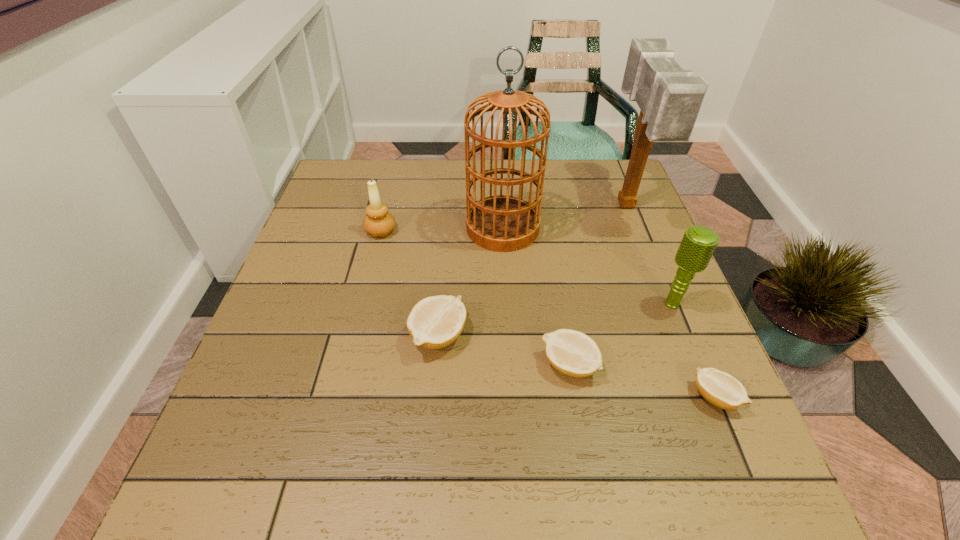
This screenshot has height=540, width=960. In order to click on the fifth closest object relative to the birdcage in this screenshot , I will do `click(573, 353)`.

Identify the location of object that is the closest to the rightmost lemon. (698, 244).

Locate an element on the screen. lemon that stands as the second closest to the second shortest object is located at coordinates (719, 388).

You are a GUI agent. You are given a task and a screenshot of the screen. Output one action in this format:
    pyautogui.click(x=<x>, y=<y>)
    Task: Click on the lemon that can be found as the closest to the microphone
    
    Given the screenshot: What is the action you would take?
    pyautogui.click(x=719, y=388)

At what (x,y) coordinates should I click in order to perform the action: click on vacant space that satisfies the following two spatial constraints: 1. on the back side of the mallet; 2. on the right side of the leftmost lemon. Please return your answer as a coordinate pair (x, y). This screenshot has height=540, width=960. Looking at the image, I should click on (449, 207).